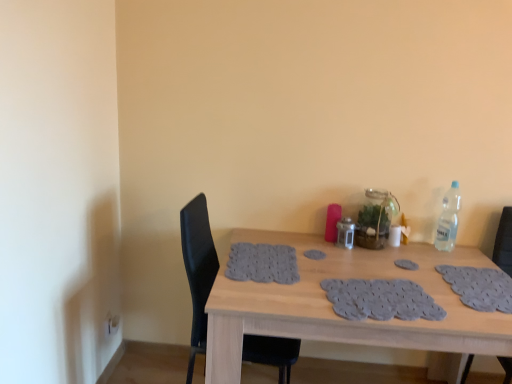
The width and height of the screenshot is (512, 384). Identify the location of vacant area that is in front of clear plastic bottle at upper right. (452, 263).